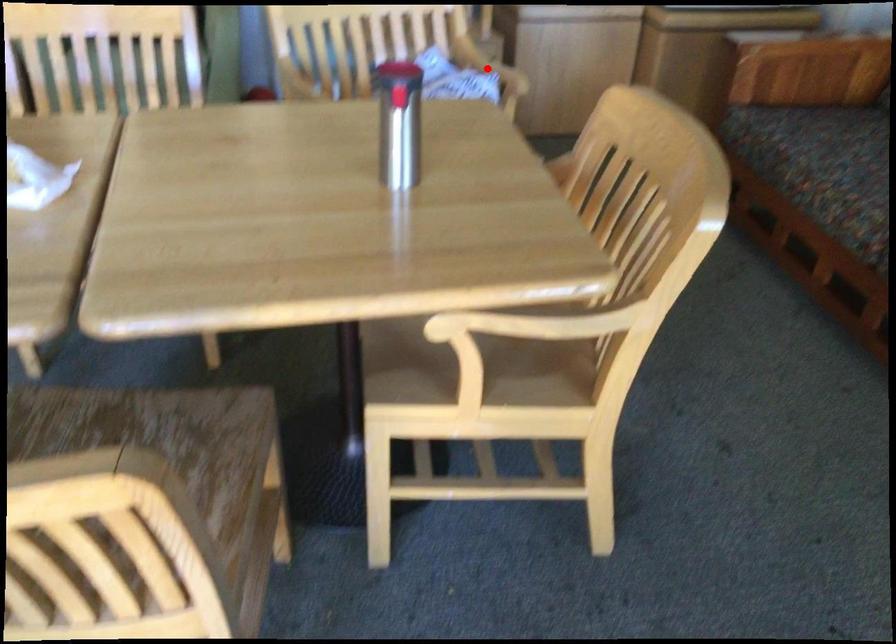
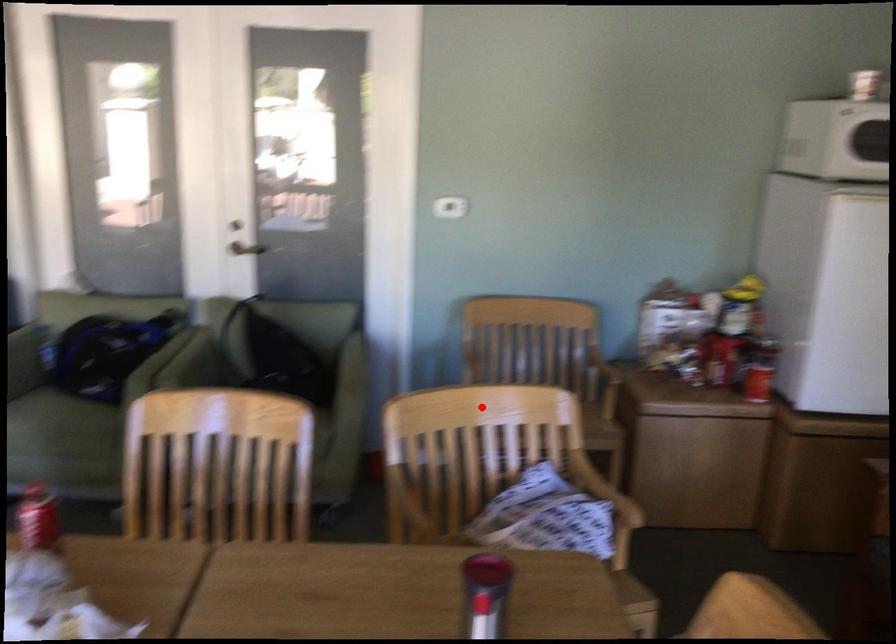
I am providing you with two images of the same scene from different viewpoints. A red point is marked on the first image and another point is marked on the second image. Are the points marked in image1 and image2 representing the same 3D position?

No